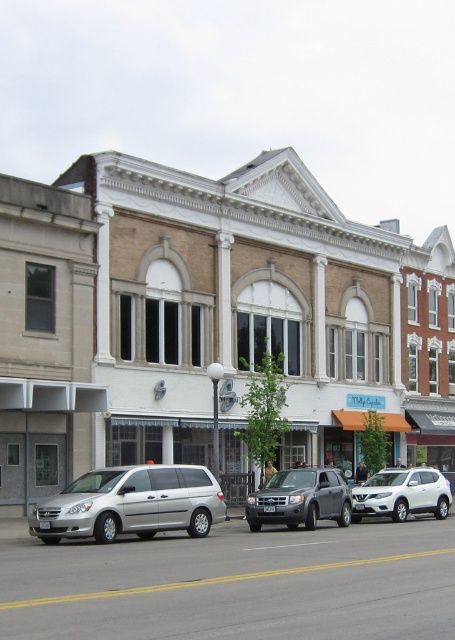
You are a delivery driver who needs to park your 2.5m tall truck in a parking spot near the Milly Cupcakes store. The parking spot has a height restriction of 2.2m. Looking at the image, which vehicle between the silver metallic van at center and the silver metallic minivan at lower left is taller than the height limit?

The silver metallic van at center is much taller than the silver metallic minivan at lower left, so it exceeds the 2.2m height restriction and cannot park there.

You are a delivery person trying to park your 2.5 meter wide truck in the parking spot between the satin silver suv at center and the white matte suv at center. Based on the scene, can your truck fit in the space between them?

The satin silver suv at center is smaller than the white matte suv at center, so the space between them may be sufficient for a 2.5 meter wide truck. However, without knowing the exact distance between the two SUVs, it is uncertain if the truck will fit.

You are a delivery driver who needs to park your truck next to the silver metallic van at center and the silver metallic minivan at lower left. Which vehicle should you park behind to ensure you have enough space for your truck, considering their sizes?

The silver metallic van at center is larger in size than the silver metallic minivan at lower left, so you should park behind the silver metallic van at center to ensure there is enough space for your truck.